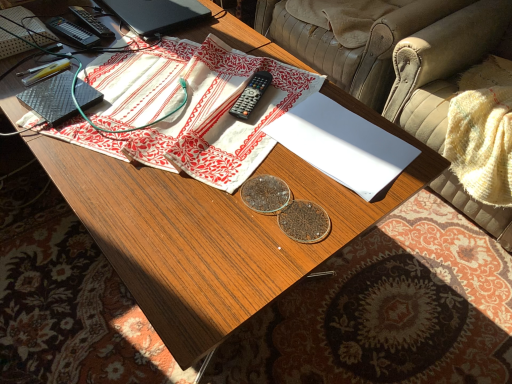
I want to click on free space in front of black plastic remote at center, so [234, 146].